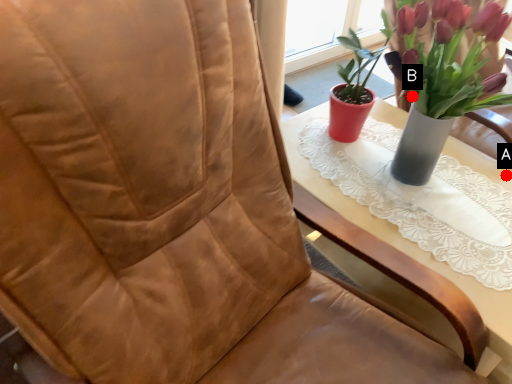
Question: Two points are circled on the image, labeled by A and B beside each circle. Which of the following is the closest to the observer?

Choices:
 (A) A is closer
 (B) B is closer

Answer: (B)